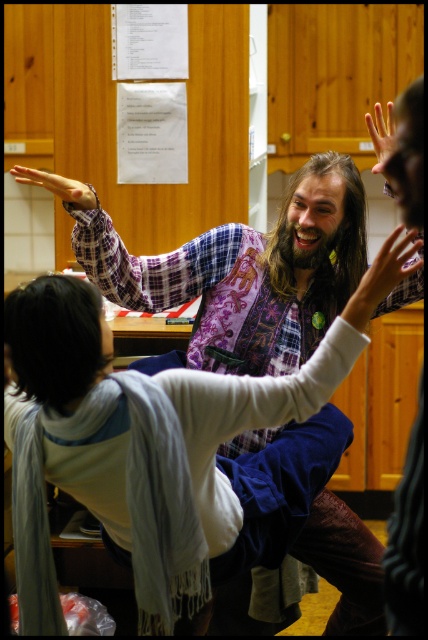
Can you confirm if dark brown hair at upper left is positioned to the right of smooth skin hand at upper left?

Yes, dark brown hair at upper left is to the right of smooth skin hand at upper left.

Who is positioned more to the left, dark brown hair at upper left or smooth skin hand at upper left?

smooth skin hand at upper left

Which is in front, point (89, 288) or point (76, 204)?

Point (89, 288) is in front.

You are a GUI agent. You are given a task and a screenshot of the screen. Output one action in this format:
    pyautogui.click(x=<x>, y=<y>)
    Task: Click on the dark brown hair at upper left
    
    Given the screenshot: What is the action you would take?
    pyautogui.click(x=55, y=339)

Can you confirm if plaid fabric arm at upper center is smaller than long brown hair at center?

Incorrect, plaid fabric arm at upper center is not smaller in size than long brown hair at center.

Can you confirm if plaid fabric arm at upper center is positioned above long brown hair at center?

Incorrect, plaid fabric arm at upper center is not positioned above long brown hair at center.

Does point (115, 230) lie in front of point (267, 266)?

Yes, it is in front of point (267, 266).

Where is `plaid fabric arm at upper center`? The image size is (428, 640). plaid fabric arm at upper center is located at coordinates (137, 257).

Measure the distance between point (55,356) and camera.

5.40 feet

Can you confirm if dark brown hair at upper left is positioned above smooth skin hand at upper center?

No, dark brown hair at upper left is not above smooth skin hand at upper center.

Is point (23, 288) behind point (391, 108)?

No.

The width and height of the screenshot is (428, 640). What are the coordinates of `dark brown hair at upper left` in the screenshot? It's located at (55, 339).